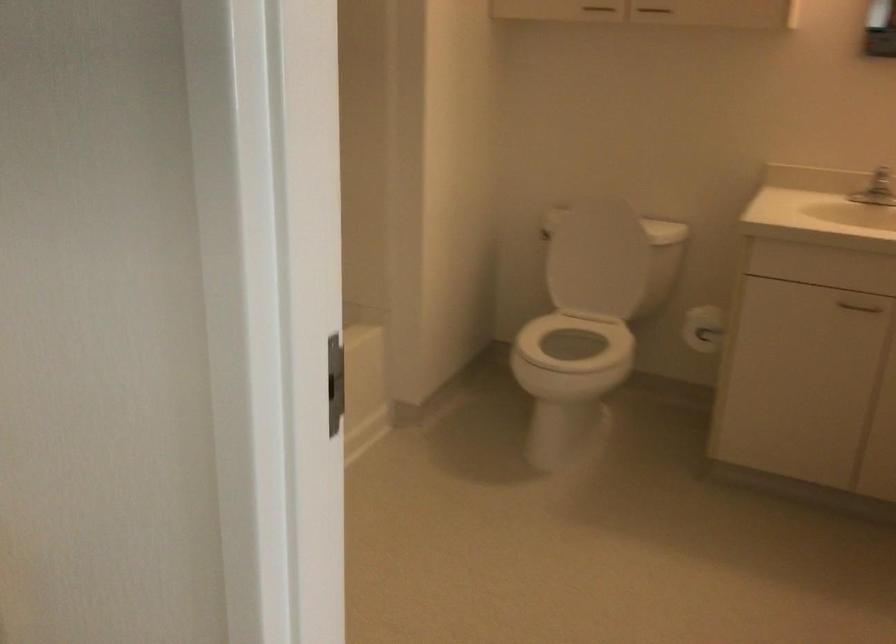
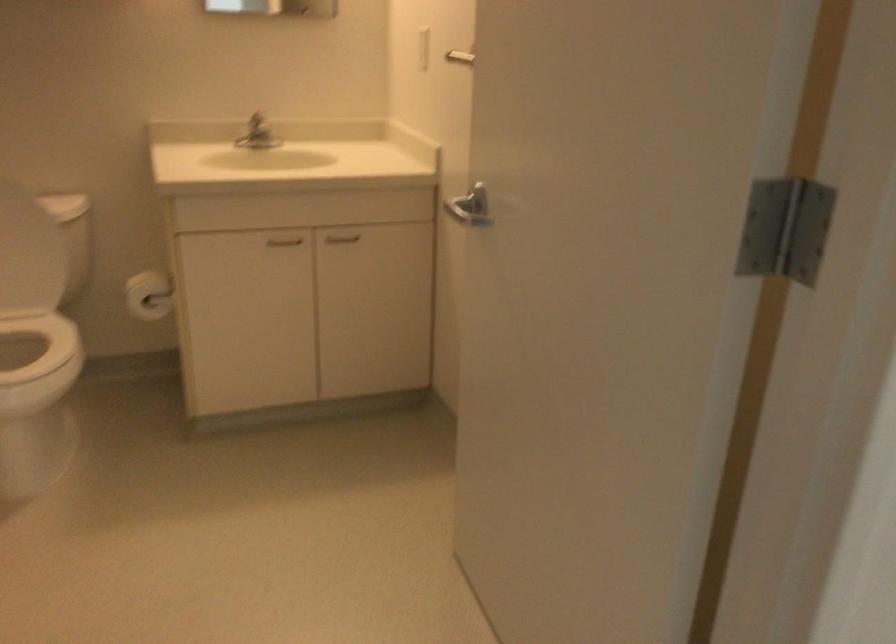
The point at (x=588, y=346) is marked in the first image. Where is the corresponding point in the second image?

(22, 341)